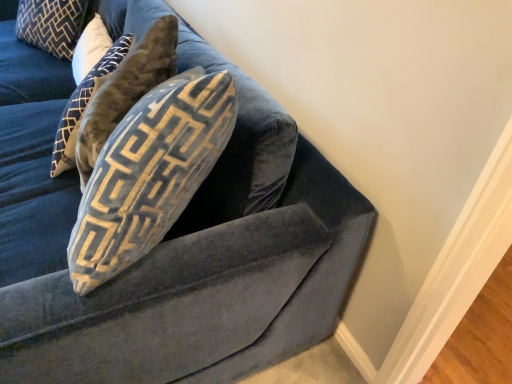
Question: Is velvet blue pillow at upper left, the 2th pillow viewed from the right, shorter than velvet couch at upper right?

Choices:
 (A) no
 (B) yes

Answer: (B)

Question: Is velvet blue pillow at upper left, the first pillow from the back, directly adjacent to velvet couch at upper right?

Choices:
 (A) no
 (B) yes

Answer: (A)

Question: From the image's perspective, is velvet blue pillow at upper left, which is counted as the 2th pillow, starting from the front, located beneath velvet couch at upper right?

Choices:
 (A) yes
 (B) no

Answer: (B)

Question: Does velvet blue pillow at upper left, which is counted as the 2th pillow, starting from the front, contain velvet couch at upper right?

Choices:
 (A) no
 (B) yes

Answer: (A)

Question: Is velvet blue pillow at upper left, which is counted as the 2th pillow, starting from the front, not close to velvet couch at upper right?

Choices:
 (A) no
 (B) yes

Answer: (B)

Question: Visually, is velvet couch at upper right positioned to the left or to the right of velvet blue pillow at upper left, which is the 2th pillow from bottom to top?

Choices:
 (A) right
 (B) left

Answer: (A)

Question: In terms of height, does velvet couch at upper right look taller or shorter compared to velvet blue pillow at upper left, which is counted as the 2th pillow, starting from the front?

Choices:
 (A) tall
 (B) short

Answer: (A)

Question: Is point (271, 302) closer or farther from the camera than point (72, 9)?

Choices:
 (A) farther
 (B) closer

Answer: (B)

Question: Looking at the image, does velvet couch at upper right seem bigger or smaller compared to velvet blue pillow at upper left, which is counted as the 2th pillow, starting from the front?

Choices:
 (A) small
 (B) big

Answer: (B)

Question: From the image's perspective, relative to velvet couch at upper right, is velvet blue pillow at upper left, which is counted as the 2th pillow, starting from the front, above or below?

Choices:
 (A) above
 (B) below

Answer: (A)

Question: Looking at the image, does velvet blue pillow at upper left, the first pillow positioned from the top, seem bigger or smaller compared to velvet couch at upper right?

Choices:
 (A) small
 (B) big

Answer: (A)

Question: In the image, is velvet blue pillow at upper left, the first pillow from the back, positioned in front of or behind velvet couch at upper right?

Choices:
 (A) front
 (B) behind

Answer: (B)

Question: Considering the positions of velvet blue pillow at upper left, which is the 2th pillow from bottom to top, and velvet couch at upper right in the image, is velvet blue pillow at upper left, which is the 2th pillow from bottom to top, wider or thinner than velvet couch at upper right?

Choices:
 (A) wide
 (B) thin

Answer: (B)

Question: From the image's perspective, is velvet couch at upper right positioned above or below velvet blue pillow at upper left, the 1th pillow positioned from the front?

Choices:
 (A) above
 (B) below

Answer: (A)

Question: From a real-world perspective, is velvet couch at upper right positioned above or below velvet blue pillow at upper left, the 1th pillow positioned from the front?

Choices:
 (A) above
 (B) below

Answer: (B)